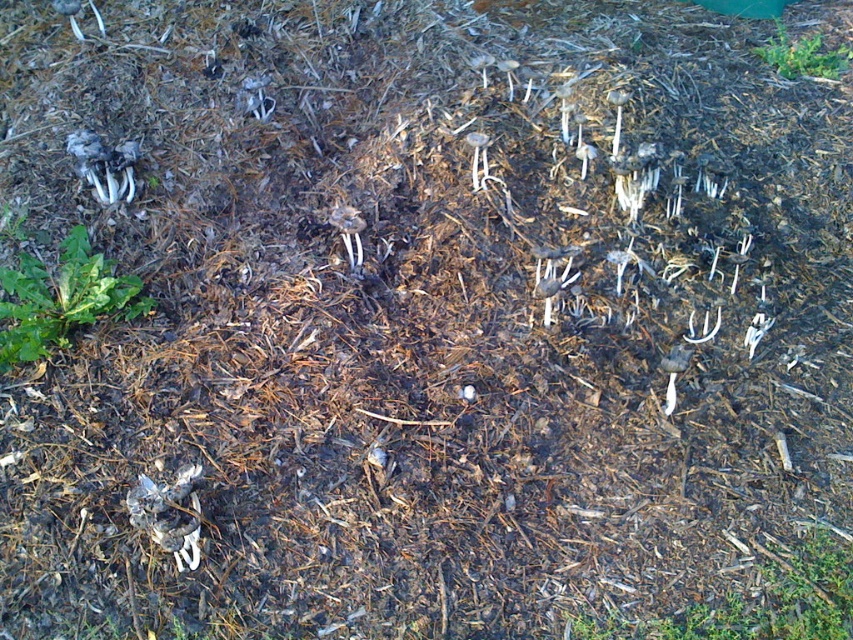
You are standing at the center of the mulched area and want to find the green leafy plant at lower left. Based on the coordinates provided, in which direction should you move to locate it?

The green leafy plant at lower left is located at coordinates point (61, 298). Since you are at the center, you should move towards the lower left direction to locate it.

You are a gardener who wants to plant a new flower between the green leafy plant at lower left and the green leafy plant at upper right. Considering their widths, which plant should you place the flower closer to to ensure enough space?

The green leafy plant at lower left is wider than the green leafy plant at upper right. Therefore, you should place the flower closer to the green leafy plant at upper right to ensure enough space.